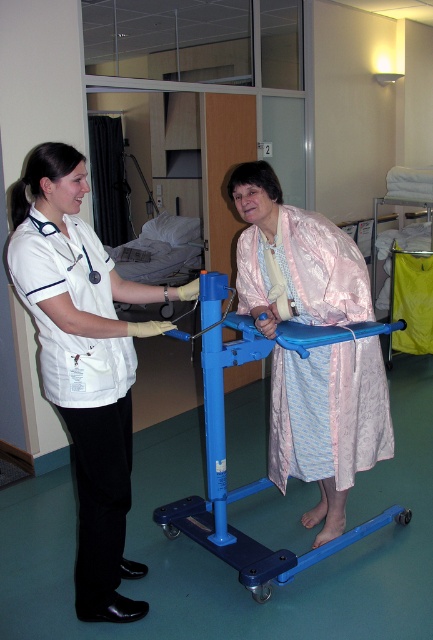
Question: Does pink satin robe at center have a greater width compared to blue plastic walker at center?

Choices:
 (A) yes
 (B) no

Answer: (B)

Question: Which point is farther to the camera?

Choices:
 (A) (274, 579)
 (B) (274, 458)

Answer: (B)

Question: Does pink satin robe at center appear on the left side of blue plastic walker at center?

Choices:
 (A) no
 (B) yes

Answer: (A)

Question: Is white smooth uniform at left bigger than pink satin robe at center?

Choices:
 (A) no
 (B) yes

Answer: (A)

Question: Which point is farther from the camera taking this photo?

Choices:
 (A) (223, 532)
 (B) (310, 518)
 (C) (54, 348)

Answer: (B)

Question: Among these objects, which one is nearest to the camera?

Choices:
 (A) white smooth uniform at left
 (B) pink satin robe at center
 (C) blue plastic walker at center

Answer: (A)